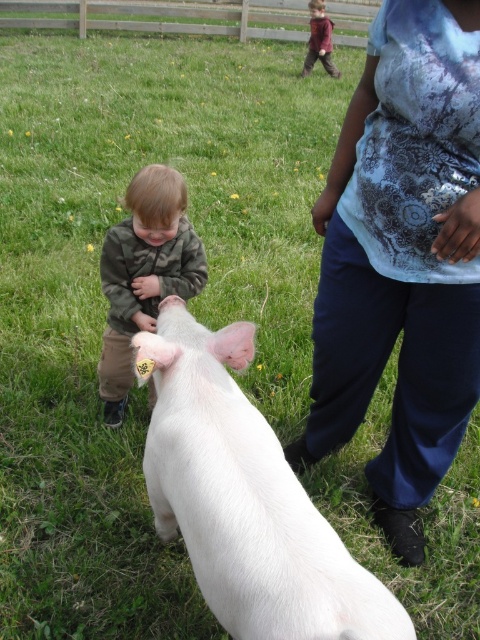
You are standing at the point marked by the coordinates point (x=244, y=497). Looking around, you see the white pig at center and the young child with light brown hair to the left. Which direction should you turn to face the young child with light brown hair?

You should turn to your left to face the young child with light brown hair because the child is positioned to the left of the white pig at center, and you are standing at the point marking the pig.

You are standing at the point marked by the coordinate point (402, 259), which corresponds to the blue tie dye shirt at center. You want to walk directly towards the white pig with a pink ear tag labeled 1986. Will you pass by the young child with light brown hair wearing a camouflage patterned jacket and beige pants?

Yes, because the blue tie dye shirt at center is located to the right of the white pig with a pink ear tag labeled 1986, and the young child with light brown hair wearing a camouflage patterned jacket and beige pants is on the left side of the pig. Walking from the right towards the pig would require passing by the child on the left.